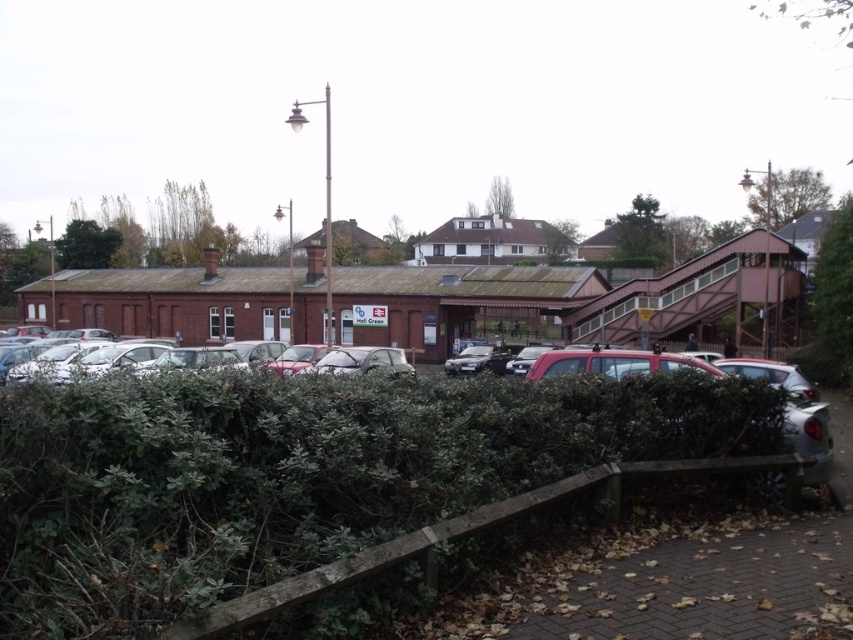
Question: Estimate the real-world distances between objects in this image. Which object is farther from the metallic silver car at center?

Choices:
 (A) green leafy hedge at lower left
 (B) silver metallic car at center

Answer: (A)

Question: Among these points, which one is nearest to the camera?

Choices:
 (A) (415, 436)
 (B) (119, 237)
 (C) (381, 353)
 (D) (479, 358)

Answer: (A)

Question: Can you confirm if green leafy hedge at lower left is positioned above silver metallic car at center?

Choices:
 (A) no
 (B) yes

Answer: (B)

Question: Can you confirm if green leafy hedge at lower left is positioned to the left of metallic silver car at center?

Choices:
 (A) no
 (B) yes

Answer: (B)

Question: Where is green leafy hedge at lower left located in relation to silver metallic car at center in the image?

Choices:
 (A) below
 (B) above

Answer: (B)

Question: Which object is farther from the camera taking this photo?

Choices:
 (A) green leafy hedge at lower left
 (B) metallic silver car at center
 (C) green leafy bush at upper left
 (D) silver metallic car at center

Answer: (C)